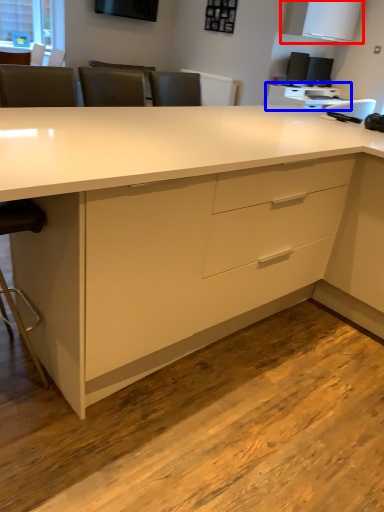
Question: Among these objects, which one is farthest to the camera, cabinetry (highlighted by a red box) or computer desk (highlighted by a blue box)?

Choices:
 (A) cabinetry
 (B) computer desk

Answer: (B)